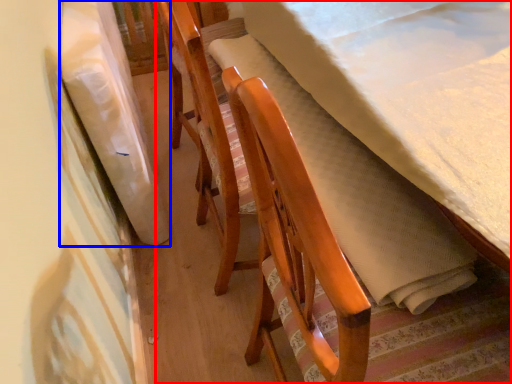
Question: Which of the following is the closest to the observer, furniture (highlighted by a red box) or blanket (highlighted by a blue box)?

Choices:
 (A) furniture
 (B) blanket

Answer: (A)